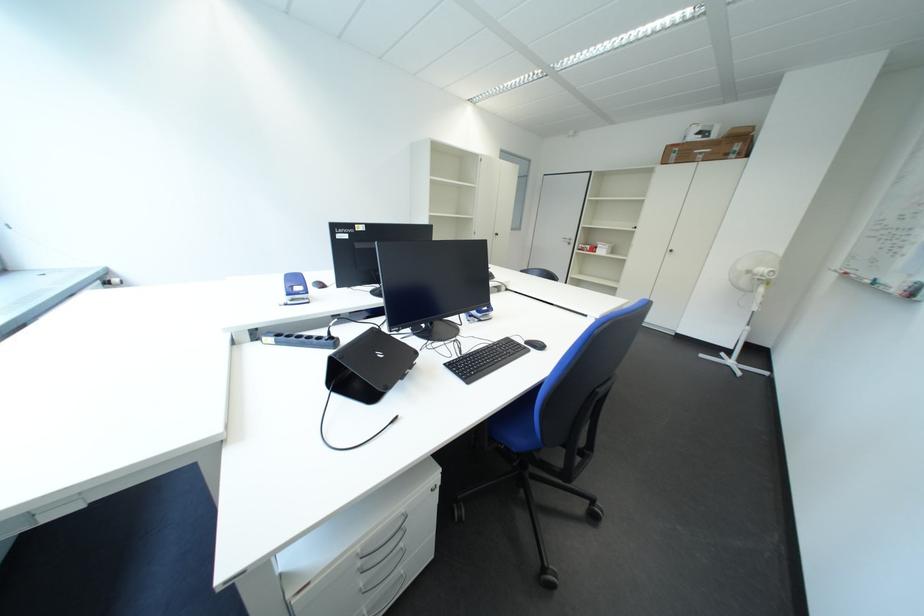
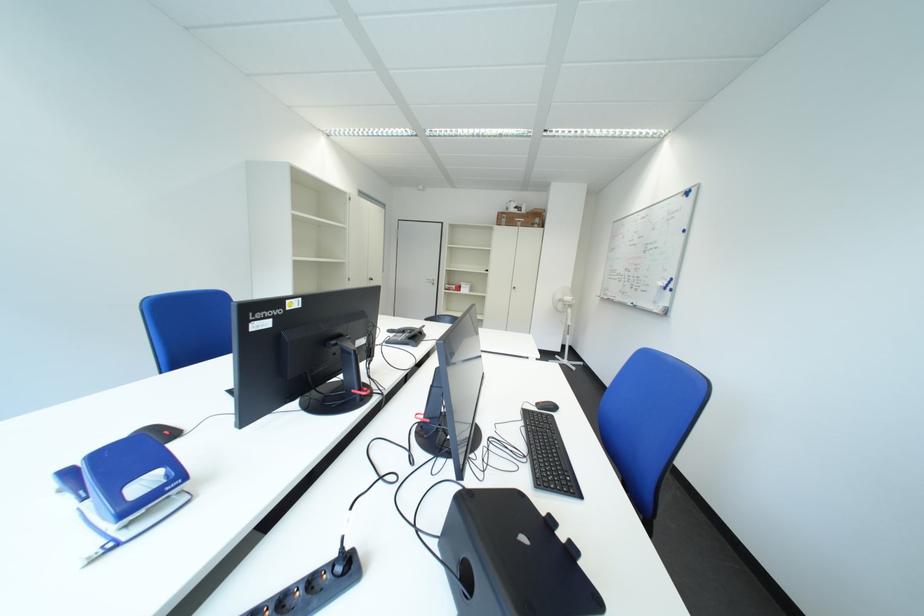
Question: Based on the continuous images, in which direction is the camera rotating? Reply with the corresponding letter.

Choices:
 (A) Left
 (B) Right
 (C) Up
 (D) Down

Answer: (B)